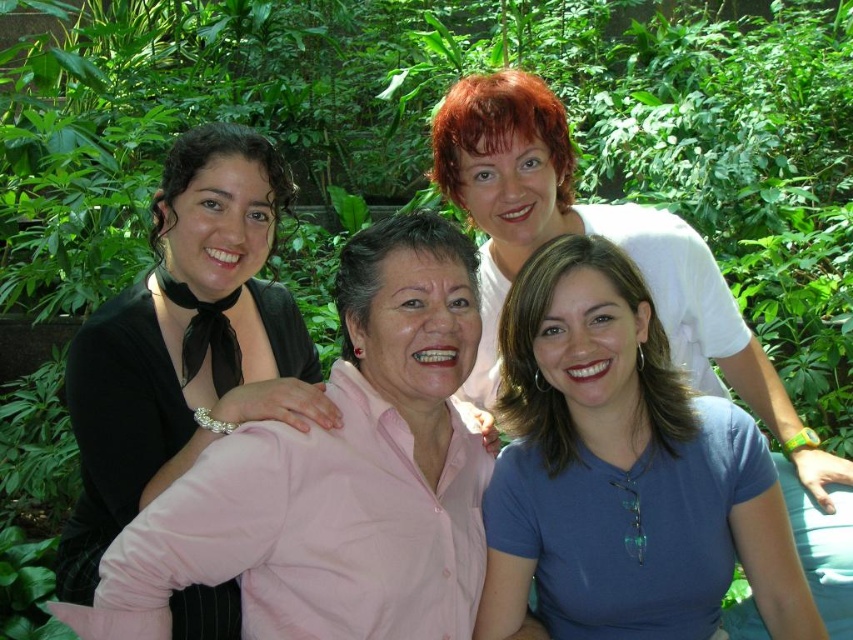
Between point (587, 499) and point (480, 202), which one is positioned in front?

Point (587, 499)

Does point (524, 264) lie in front of point (695, 360)?

Yes.

Which is in front, point (508, 408) or point (688, 243)?

Point (508, 408)

Find the location of a particular element. blue matte shirt at lower right is located at coordinates (624, 472).

Between point (514, 346) and point (151, 387), which one is positioned behind?

Point (151, 387)

At what (x,y) coordinates should I click in order to perform the action: click on blue matte shirt at lower right. Please return your answer as a coordinate pair (x, y). The image size is (853, 640). Looking at the image, I should click on (624, 472).

Find the location of a particular element. blue matte shirt at lower right is located at coordinates (624, 472).

Does black satin blouse at left have a larger size compared to white matte shirt at upper center?

Indeed, black satin blouse at left has a larger size compared to white matte shirt at upper center.

Between black satin blouse at left and white matte shirt at upper center, which one appears on the left side from the viewer's perspective?

black satin blouse at left

Which is in front, point (280, 333) or point (439, 164)?

Point (439, 164) is more forward.

The height and width of the screenshot is (640, 853). In order to click on black satin blouse at left in this screenshot , I will do [x=186, y=342].